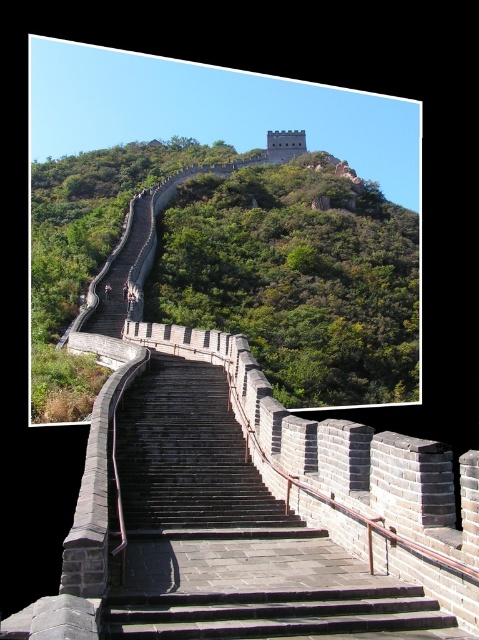
The width and height of the screenshot is (479, 640). Find the location of `dark gray stone stairs at center`. dark gray stone stairs at center is located at coordinates (228, 532).

Is the position of dark gray stone stairs at center less distant than that of green stone wall at upper center?

Yes, it is in front of green stone wall at upper center.

Is point (385, 604) closer to camera compared to point (332, 240)?

Yes, it is.

The width and height of the screenshot is (479, 640). Identify the location of dark gray stone stairs at center. (228, 532).